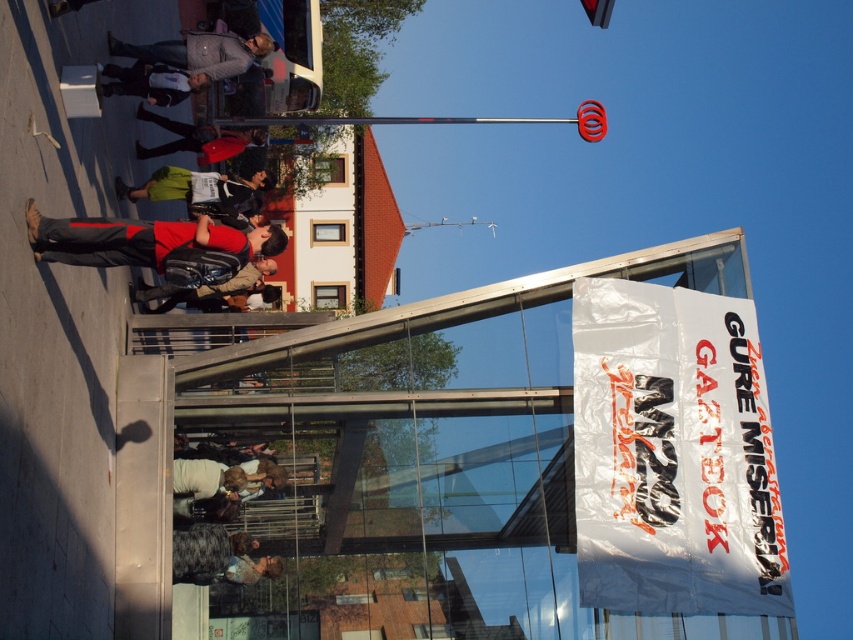
You are a photographer standing in front of the glass structure with the banner. You want to take a photo of the gray fabric jacket at upper center and the matte black backpack at center. Which object should you zoom in on to capture both in the frame without moving the camera?

The gray fabric jacket at upper center might be wider than the matte black backpack at center, so you should zoom in on the matte black backpack at center to ensure both are in frame.

You are a delivery person carrying a package that requires a 3 meter clearance to pass through a narrow alleyway. You need to navigate between the gray fabric jacket at upper center and the matte black backpack at center. Can you safely pass through the space between them without hitting the package?

The distance between the gray fabric jacket at upper center and the matte black backpack at center is 4.53 meters, which is wider than the required 3 meter clearance. Therefore, you can safely pass through the space between them without hitting the package.